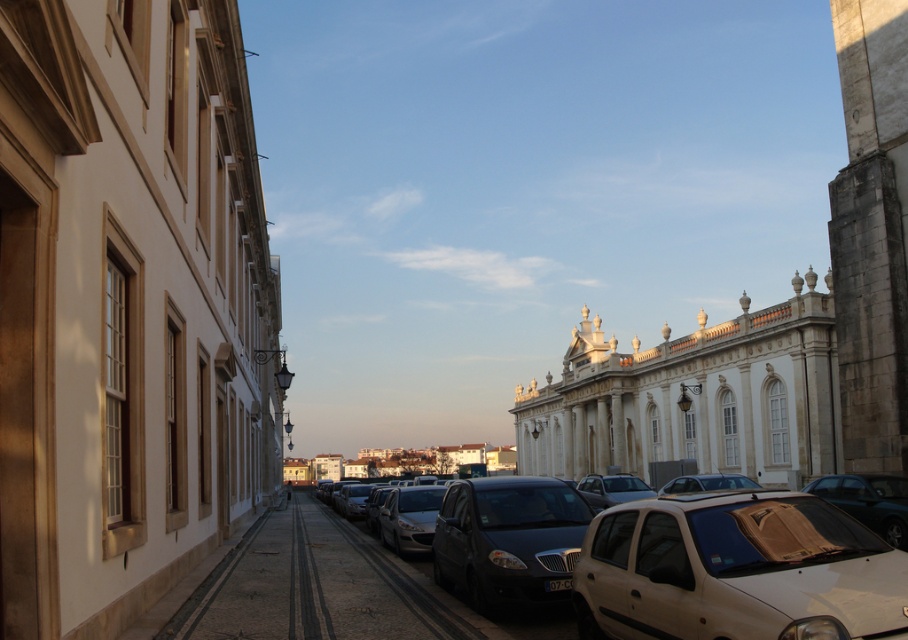
Question: Considering the relative positions of matte black car at center and shiny black sedan at center in the image provided, where is matte black car at center located with respect to shiny black sedan at center?

Choices:
 (A) right
 (B) left

Answer: (A)

Question: Considering the relative positions of matte black car at center and smooth stone tower at right in the image provided, where is matte black car at center located with respect to smooth stone tower at right?

Choices:
 (A) right
 (B) left

Answer: (B)

Question: Which point is closer to the camera taking this photo?

Choices:
 (A) (865, 445)
 (B) (479, 518)

Answer: (B)

Question: Which of the following is the farthest from the observer?

Choices:
 (A) (881, 531)
 (B) (892, 355)

Answer: (B)

Question: In this image, where is smooth stone tower at right located relative to shiny black sedan at center?

Choices:
 (A) left
 (B) right

Answer: (B)

Question: Which object appears closest to the camera in this image?

Choices:
 (A) matte black car at center
 (B) matte black car at lower right

Answer: (A)